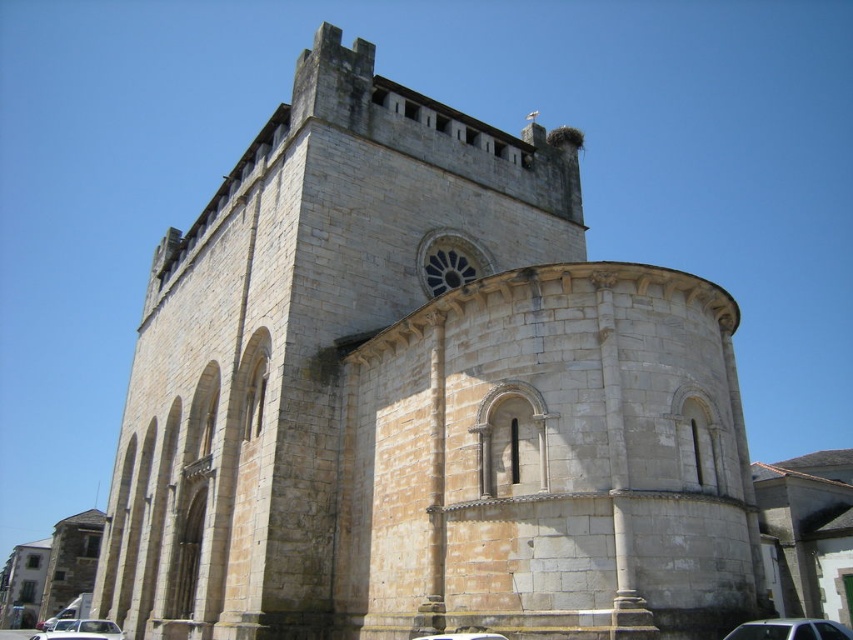
Between metallic silver car at lower right and white matte car at lower center, which one is positioned lower?

metallic silver car at lower right is lower down.

Which of these two, metallic silver car at lower right or white matte car at lower center, stands taller?

metallic silver car at lower right is taller.

Is point (814, 636) closer to viewer compared to point (483, 636)?

That is True.

Where is `metallic silver car at lower right`? metallic silver car at lower right is located at coordinates (790, 628).

Can you confirm if metallic silver car at lower right is thinner than white matte car at lower left?

Indeed, metallic silver car at lower right has a lesser width compared to white matte car at lower left.

Which is behind, point (799, 625) or point (53, 636)?

The point (53, 636) is behind.

Is point (747, 624) farther from viewer compared to point (90, 625)?

No, (747, 624) is closer to viewer.

Locate an element on the screen. The image size is (853, 640). metallic silver car at lower right is located at coordinates (790, 628).

Which is behind, point (96, 627) or point (434, 637)?

Point (96, 627)

Consider the image. Is white matte car at lower left taller than white matte car at lower center?

Indeed, white matte car at lower left has a greater height compared to white matte car at lower center.

Is point (32, 637) positioned behind point (422, 637)?

That is True.

Image resolution: width=853 pixels, height=640 pixels. What are the coordinates of `white matte car at lower left` in the screenshot? It's located at (82, 628).